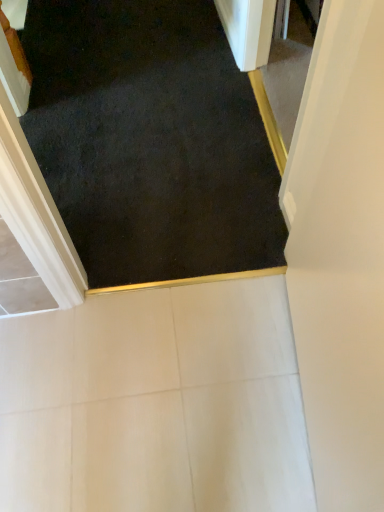
Describe the element at coordinates (150, 141) in the screenshot. The image size is (384, 512). I see `dark carpet at center` at that location.

Locate an element on the screen. dark carpet at center is located at coordinates (150, 141).

Measure the distance between point (208, 7) and camera.

They are 2.22 meters apart.

This screenshot has height=512, width=384. I want to click on dark carpet at center, so click(150, 141).